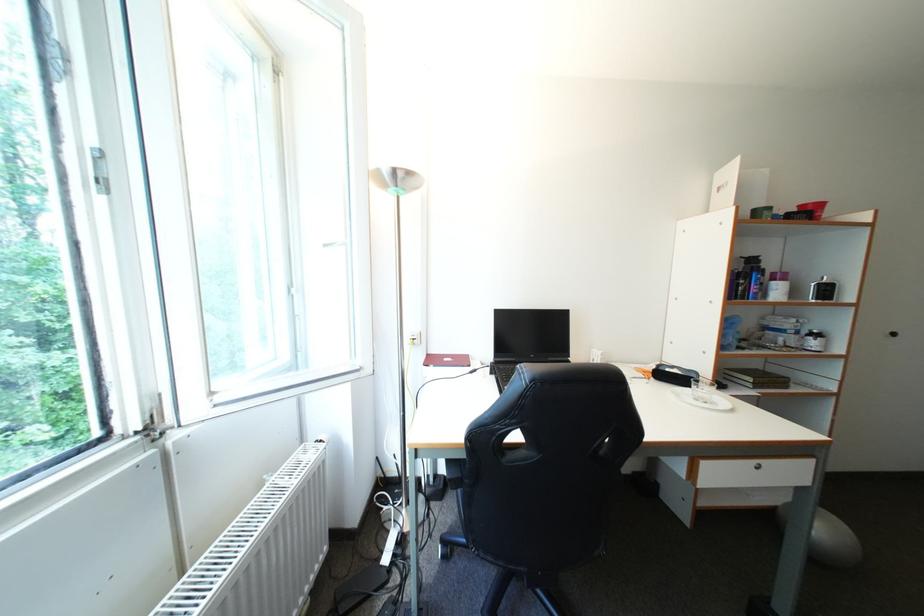
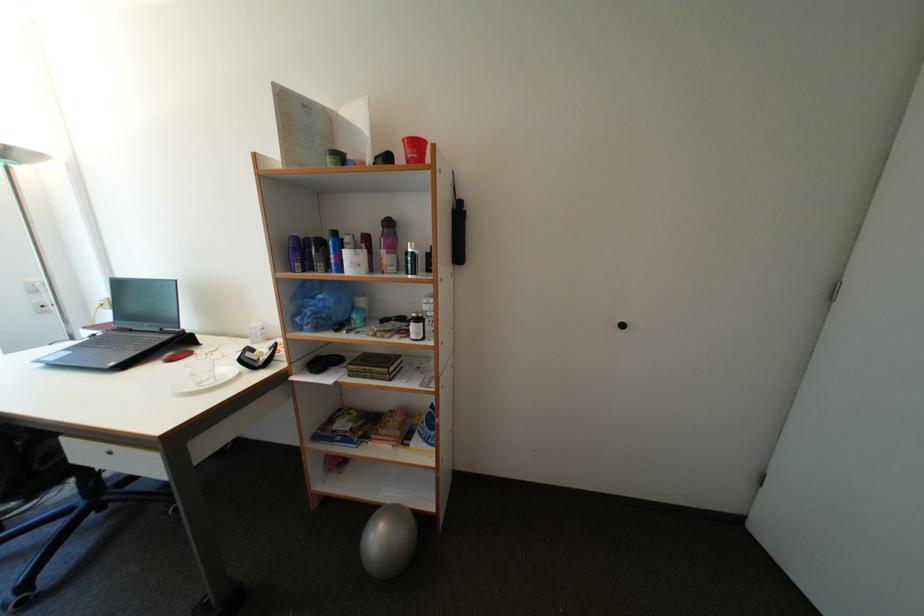
Question: What movement of the cameraman would produce the second image?

Choices:
 (A) Left
 (B) Right
 (C) Forward
 (D) Backward

Answer: (B)